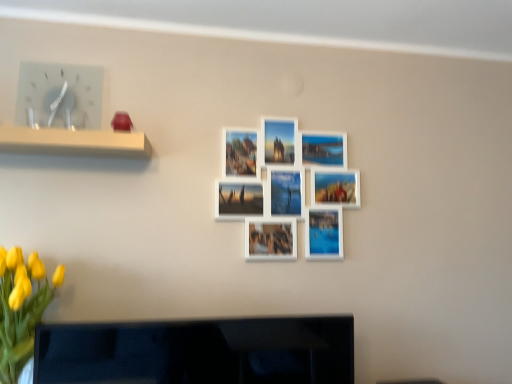
Question: Would you say white plastic clock at upper left is to the left or to the right of yellow matte flowers at lower left in the picture?

Choices:
 (A) left
 (B) right

Answer: (A)

Question: From a real-world perspective, relative to yellow matte flowers at lower left, is white plastic clock at upper left vertically above or below?

Choices:
 (A) below
 (B) above

Answer: (B)

Question: Which object is the farthest from the black glossy tv at lower center?

Choices:
 (A) white plastic clock at upper left
 (B) yellow matte flowers at lower left
 (C) white glossy photo frames at center

Answer: (A)

Question: Considering the real-world distances, which object is closest to the black glossy tv at lower center?

Choices:
 (A) white glossy photo frames at center
 (B) yellow matte flowers at lower left
 (C) white plastic clock at upper left

Answer: (B)